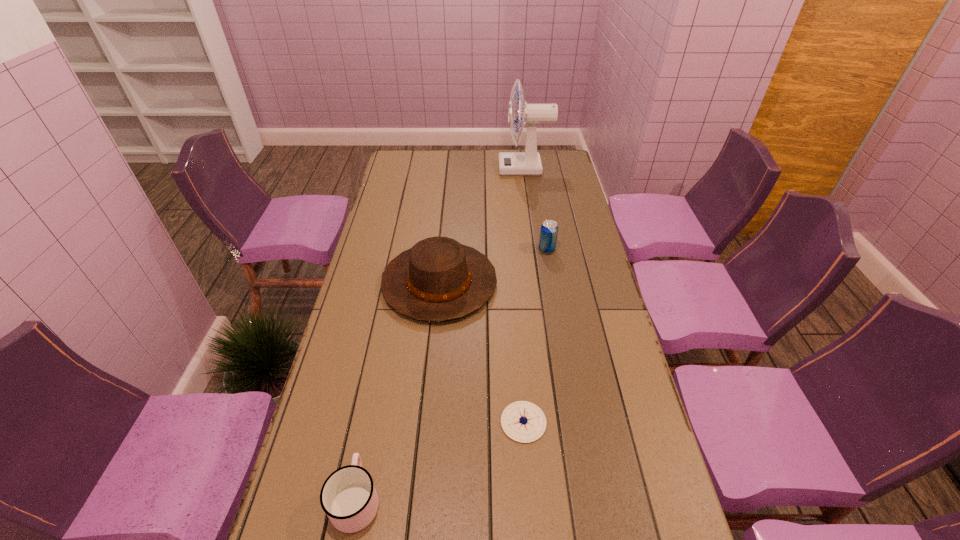
Image resolution: width=960 pixels, height=540 pixels. Identify the location of fan located in the right edge section of the desktop. (528, 163).

You are a GUI agent. You are given a task and a screenshot of the screen. Output one action in this format:
    pyautogui.click(x=<x>, y=<y>)
    Task: Click on the beer can situated at the right edge
    The image size is (960, 540).
    Given the screenshot: What is the action you would take?
    pyautogui.click(x=549, y=230)

The height and width of the screenshot is (540, 960). I want to click on object present at the far right corner, so click(x=528, y=163).

Locate an element on the screen. Image resolution: width=960 pixels, height=540 pixels. vacant region at the left edge is located at coordinates (407, 186).

The height and width of the screenshot is (540, 960). What are the coordinates of `vacant space at the right edge of the desktop` in the screenshot? It's located at (581, 210).

I want to click on vacant space that's between the tallest object and the fourth tallest object, so click(441, 334).

Where is `free space between the second shortest object and the beer can`? The image size is (960, 540). free space between the second shortest object and the beer can is located at coordinates (451, 375).

At what (x,y) coordinates should I click in order to perform the action: click on free space between the third shortest object and the tallest object. Please return your answer as a coordinate pair (x, y). This screenshot has height=540, width=960. Looking at the image, I should click on (536, 209).

At what (x,y) coordinates should I click in order to perform the action: click on free space that is in between the second shortest object and the compass. Please return your answer as a coordinate pair (x, y). The image size is (960, 540). Looking at the image, I should click on click(440, 461).

Find the location of a particular element. The height and width of the screenshot is (540, 960). vacant space that is in between the beer can and the nearest object is located at coordinates (451, 375).